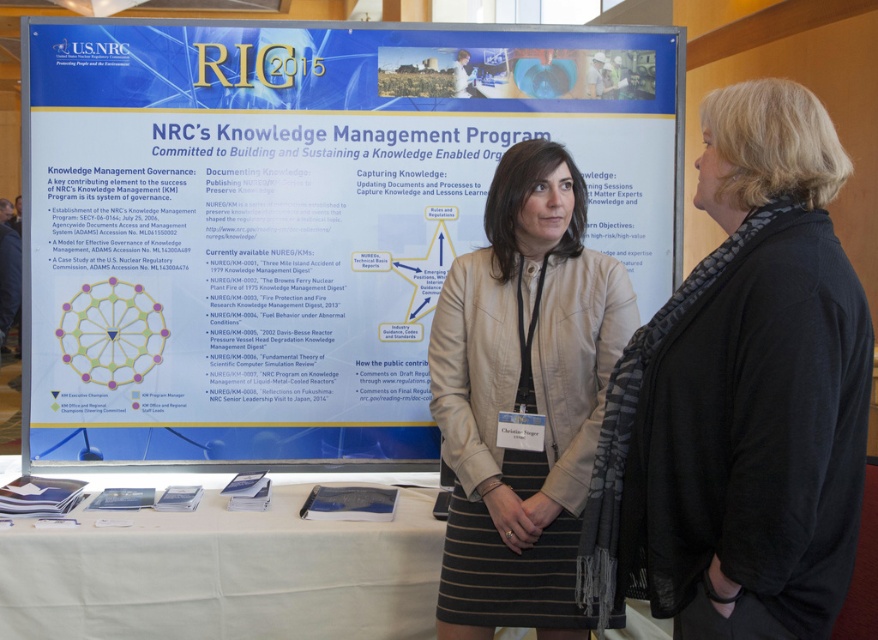
You are standing in front of the NRC Knowledge Management poster and want to touch both points mentioned. Which point should you reach for first, the one at coordinates point (444, 170) or point (639, 524)?

You should reach for point (444, 170) first because it is closer to you than point (639, 524), which is further away.